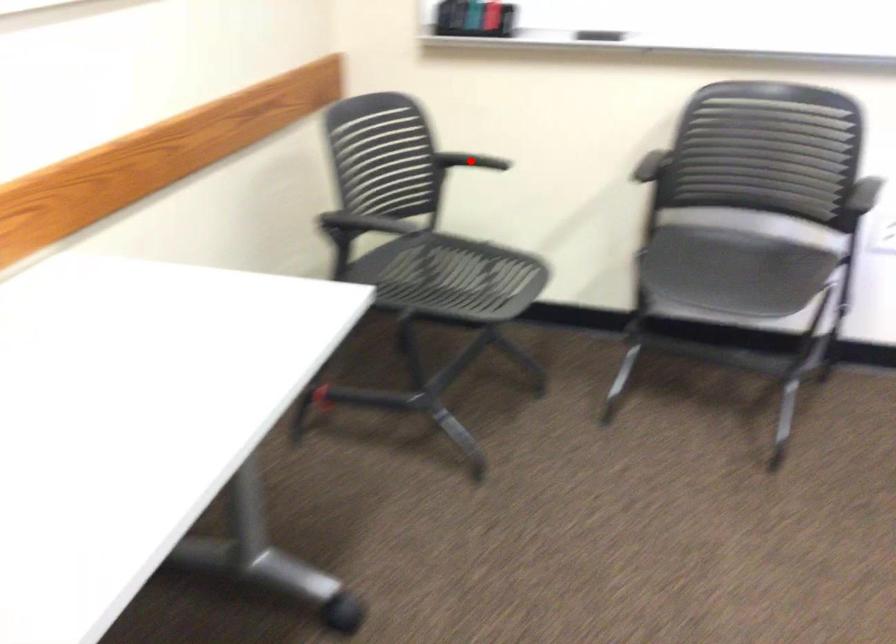
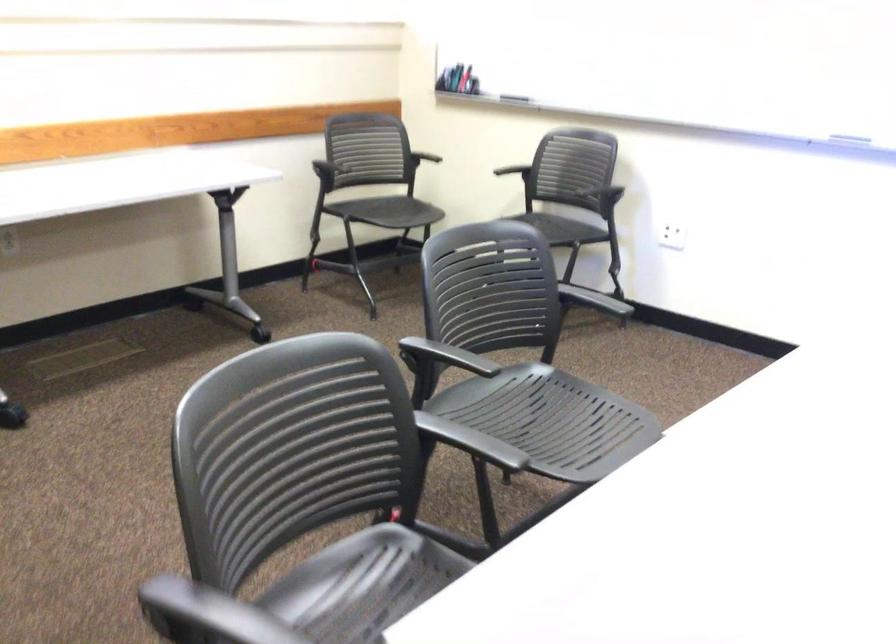
Locate, in the second image, the point that corresponds to the highlighted location in the first image.

(425, 147)